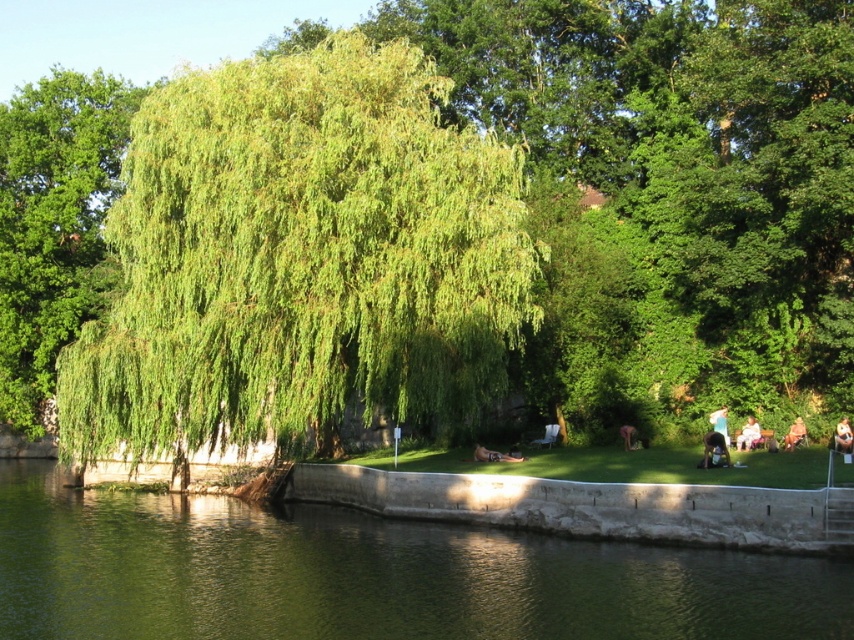
Which is below, smooth black dog at center or pink fabric chair at right?

Positioned lower is pink fabric chair at right.

Which is behind, point (700, 464) or point (743, 448)?

Point (743, 448)

Image resolution: width=854 pixels, height=640 pixels. Identify the location of smooth black dog at center. (714, 451).

Who is shorter, pink fabric chair at right or brown leather jacket at lower right?

Standing shorter between the two is brown leather jacket at lower right.

Is point (753, 426) positioned behind point (788, 429)?

That is False.

Identify the location of pink fabric chair at right. (747, 435).

Between green leafy tree at left and light blue shirt at center, which one appears on the right side from the viewer's perspective?

Positioned to the right is light blue shirt at center.

Which is behind, point (28, 243) or point (720, 422)?

Point (28, 243)

The width and height of the screenshot is (854, 640). Find the location of `green leafy tree at left`. green leafy tree at left is located at coordinates (54, 225).